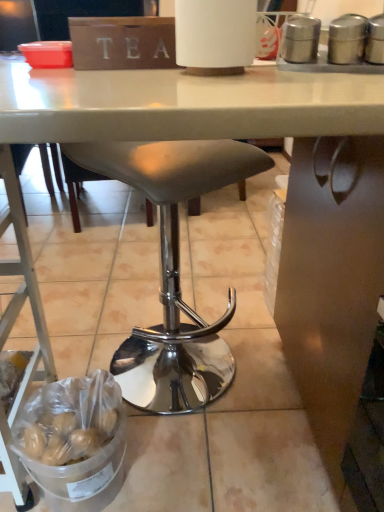
Question: Does point (213, 174) appear closer or farther from the camera than point (43, 343)?

Choices:
 (A) farther
 (B) closer

Answer: (B)

Question: In terms of width, does matte gray stool at center look wider or thinner when compared to metallic silver ladder at lower left?

Choices:
 (A) wide
 (B) thin

Answer: (B)

Question: Estimate the real-world distances between objects in this image. Which object is closer to the metallic silver ladder at lower left?

Choices:
 (A) silver metallic canisters at upper right
 (B) matte gray stool at center

Answer: (B)

Question: Which object is the farthest from the matte gray stool at center?

Choices:
 (A) metallic silver ladder at lower left
 (B) silver metallic canisters at upper right

Answer: (B)